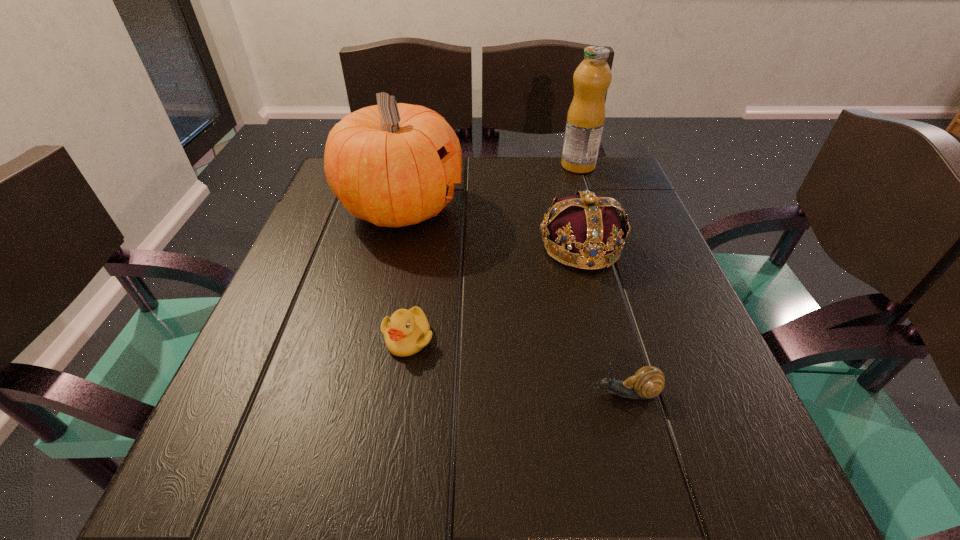
Image resolution: width=960 pixels, height=540 pixels. What are the coordinates of `crown at the right edge` in the screenshot? It's located at (590, 227).

Image resolution: width=960 pixels, height=540 pixels. Find the location of `escargot situated at the right edge`. escargot situated at the right edge is located at coordinates (647, 382).

Image resolution: width=960 pixels, height=540 pixels. What are the coordinates of `object that is positioned at the far left corner` in the screenshot? It's located at (393, 164).

You are a GUI agent. You are given a task and a screenshot of the screen. Output one action in this format:
    pyautogui.click(x=<x>, y=<y>)
    Task: Click on the object located at the far right corner
    
    Given the screenshot: What is the action you would take?
    pyautogui.click(x=585, y=120)

At what (x,y) coordinates should I click in order to perform the action: click on vacant space at the far edge of the desktop. Please return your answer as a coordinate pair (x, y). The width and height of the screenshot is (960, 540). Looking at the image, I should click on click(x=557, y=190).

This screenshot has height=540, width=960. I want to click on vacant region at the near edge, so click(596, 455).

Where is `free point at the left edge`? The width and height of the screenshot is (960, 540). free point at the left edge is located at coordinates (323, 401).

I want to click on free space at the right edge, so click(630, 211).

Image resolution: width=960 pixels, height=540 pixels. Identify the location of vacant area at the far right corner. (613, 189).

You are a GUI agent. You are given a task and a screenshot of the screen. Output one action in this format:
    pyautogui.click(x=<x>, y=<y>)
    Task: Click on the blank region between the fourth tallest object and the farthest object
    The image size is (960, 540).
    Given the screenshot: What is the action you would take?
    pos(493,252)